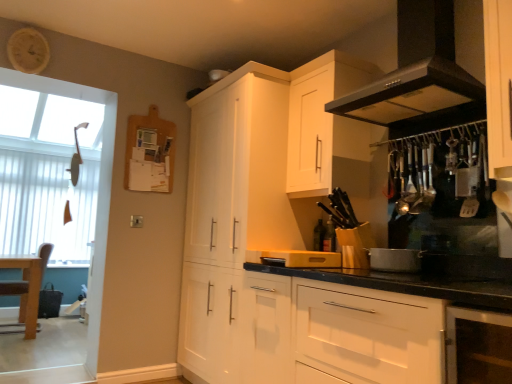
Question: Is wooden tray at center, marked as the first appliance in a left-to-right arrangement, spatially inside white glossy cabinet at upper center, the first cabinetry in the back-to-front sequence, or outside of it?

Choices:
 (A) inside
 (B) outside

Answer: (B)

Question: Considering the positions of wooden tray at center, which is the 2th appliance from right to left, and white glossy cabinet at upper center, the first cabinetry in the back-to-front sequence, in the image, is wooden tray at center, which is the 2th appliance from right to left, taller or shorter than white glossy cabinet at upper center, the first cabinetry in the back-to-front sequence,?

Choices:
 (A) tall
 (B) short

Answer: (B)

Question: Considering the real-world distances, which object is farthest from the silver metallic pot at center, positioned as the first appliance in right-to-left order?

Choices:
 (A) brown wooden chair at left
 (B) black matte exhaust hood at upper right
 (C) white matte cabinet at lower center, the first cabinetry when ordered from front to back
 (D) white vertical blinds at left
 (E) wooden tray at center, marked as the first appliance in a left-to-right arrangement

Answer: (D)

Question: Estimate the real-world distances between objects in this image. Which object is farther from the white matte cabinet at lower center, positioned as the 3th cabinetry in back-to-front order?

Choices:
 (A) brown wooden chair at left
 (B) white glossy cabinet at upper center, positioned as the 3th cabinetry in front-to-back order
 (C) wooden tray at center, which is the 2th appliance from right to left
 (D) white glossy cabinet at upper right, the second cabinetry viewed from the front
 (E) silver metallic pot at center, positioned as the first appliance in right-to-left order

Answer: (A)